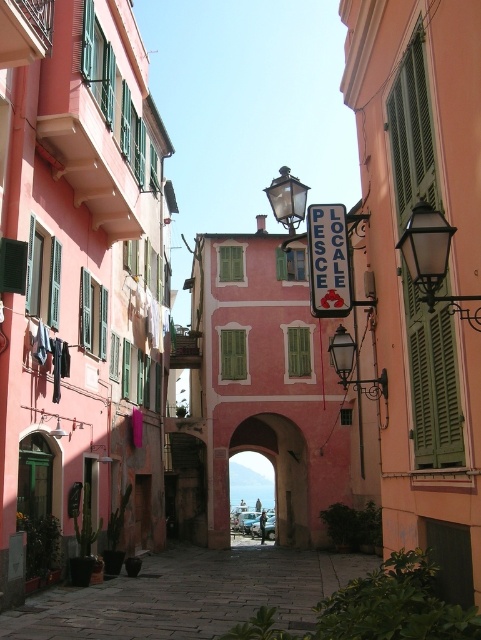
You are a tourist standing on the cobblestone street in front of the buildings. You want to read the white plastic sign at center but notice the green matte shutter at center might be blocking your view. Is the sign above or below the shutter?

The white plastic sign at center is above the green matte shutter at center, so it is not blocked by the shutter and should be visible.